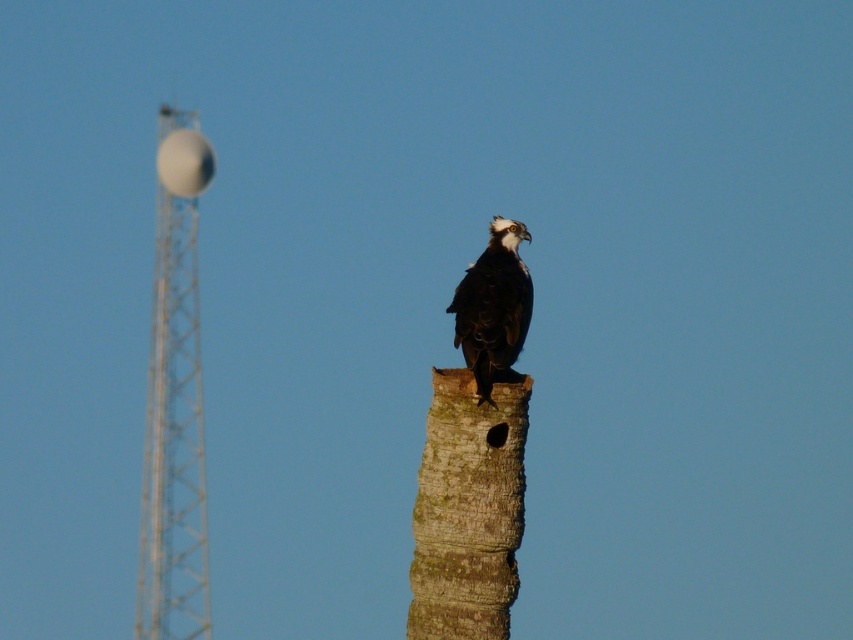
Question: Does brown rough tree trunk at center have a lesser width compared to white metallic tower at left?

Choices:
 (A) no
 (B) yes

Answer: (B)

Question: Does brown rough tree trunk at center have a smaller size compared to dark brown feathers at center?

Choices:
 (A) yes
 (B) no

Answer: (B)

Question: Which object is the closest to the white metallic tower at left?

Choices:
 (A) dark brown feathers at center
 (B) brown rough tree trunk at center

Answer: (B)

Question: Can you confirm if brown rough tree trunk at center is positioned below white metallic tower at left?

Choices:
 (A) no
 (B) yes

Answer: (A)

Question: Among these objects, which one is nearest to the camera?

Choices:
 (A) brown rough tree trunk at center
 (B) white metallic tower at left
 (C) dark brown feathers at center

Answer: (A)

Question: Which object appears farthest from the camera in this image?

Choices:
 (A) white metallic tower at left
 (B) brown rough tree trunk at center
 (C) dark brown feathers at center

Answer: (A)